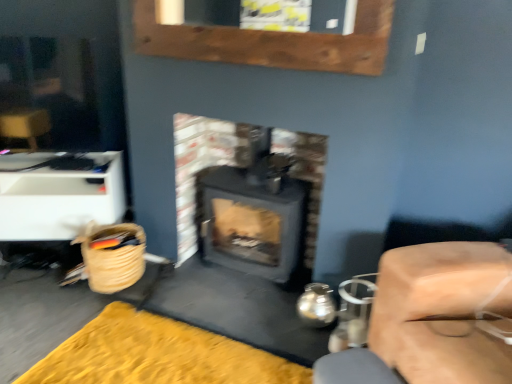
Question: Can you confirm if woven straw basket at lower left is positioned to the right of smooth beige cushion at right, which is the 2th furniture in left-to-right order?

Choices:
 (A) no
 (B) yes

Answer: (A)

Question: Is the position of woven straw basket at lower left less distant than that of smooth beige cushion at right, which is the 2th furniture in left-to-right order?

Choices:
 (A) no
 (B) yes

Answer: (A)

Question: Does woven straw basket at lower left have a larger size compared to smooth beige cushion at right, which is the 2th furniture in left-to-right order?

Choices:
 (A) yes
 (B) no

Answer: (B)

Question: From the image's perspective, is woven straw basket at lower left on top of smooth beige cushion at right, which is the 2th furniture in left-to-right order?

Choices:
 (A) no
 (B) yes

Answer: (B)

Question: Is woven straw basket at lower left taller than smooth beige cushion at right, which is the 2th furniture in left-to-right order?

Choices:
 (A) yes
 (B) no

Answer: (B)

Question: Does woven straw basket at lower left have a smaller size compared to smooth beige cushion at right, which is the 2th furniture in left-to-right order?

Choices:
 (A) yes
 (B) no

Answer: (A)

Question: Considering the relative sizes of yellow plush rug at lower left and matte black wood burning stove at center in the image provided, is yellow plush rug at lower left thinner than matte black wood burning stove at center?

Choices:
 (A) no
 (B) yes

Answer: (A)

Question: Can you confirm if yellow plush rug at lower left is positioned to the right of matte black wood burning stove at center?

Choices:
 (A) no
 (B) yes

Answer: (A)

Question: Considering the relative sizes of yellow plush rug at lower left and matte black wood burning stove at center in the image provided, is yellow plush rug at lower left shorter than matte black wood burning stove at center?

Choices:
 (A) yes
 (B) no

Answer: (A)

Question: Considering the relative sizes of yellow plush rug at lower left and matte black wood burning stove at center in the image provided, is yellow plush rug at lower left smaller than matte black wood burning stove at center?

Choices:
 (A) yes
 (B) no

Answer: (A)

Question: Does yellow plush rug at lower left turn towards matte black wood burning stove at center?

Choices:
 (A) yes
 (B) no

Answer: (B)

Question: Is yellow plush rug at lower left positioned beyond the bounds of matte black wood burning stove at center?

Choices:
 (A) yes
 (B) no

Answer: (A)

Question: From a real-world perspective, is white plastic drawer at left, which is counted as the second furniture, starting from the front, under woven straw basket at lower left?

Choices:
 (A) yes
 (B) no

Answer: (B)